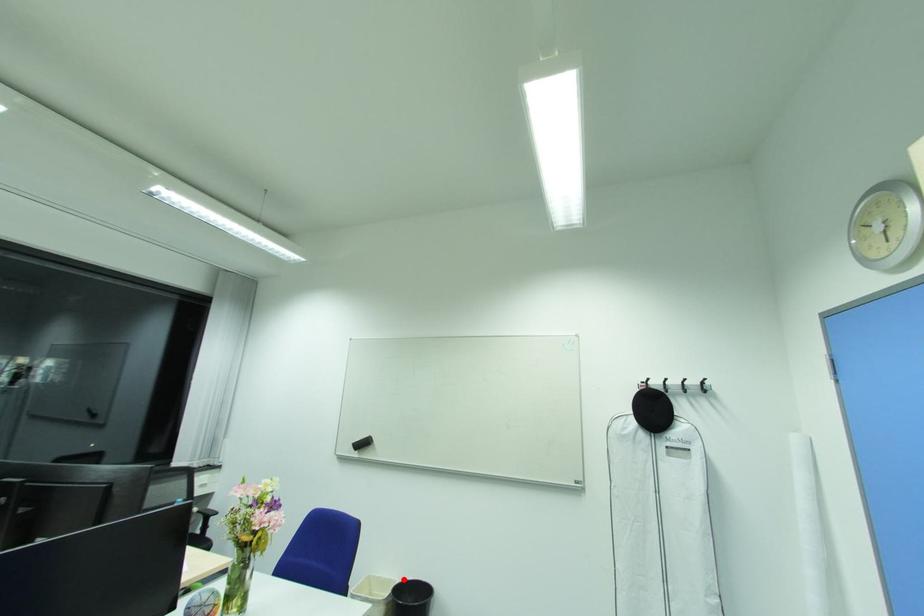
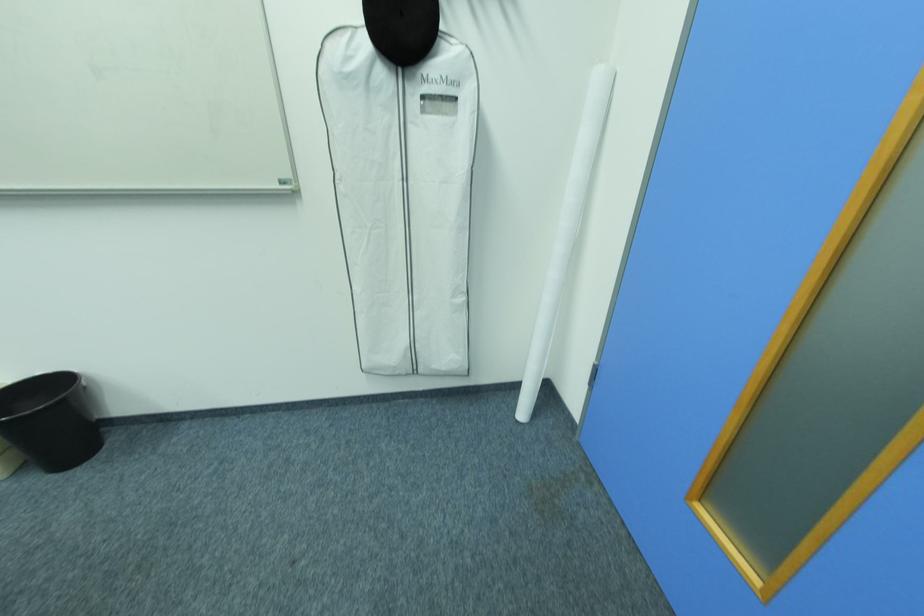
Question: I am providing you with two images of the same scene from different viewpoints. In image1, a red point is highlighted. Considering the same 3D point in image2, which of the following is correct?

Choices:
 (A) It is closer
 (B) It is farther

Answer: (A)